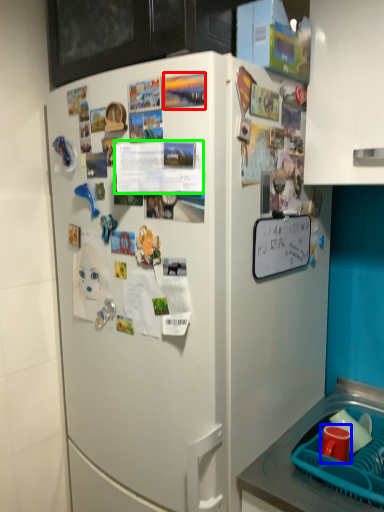
Question: Based on their relative distances, which object is nearer to poster (highlighted by a red box)? Choose from coffee cup (highlighted by a blue box) and poster (highlighted by a green box).

Choices:
 (A) coffee cup
 (B) poster

Answer: (B)